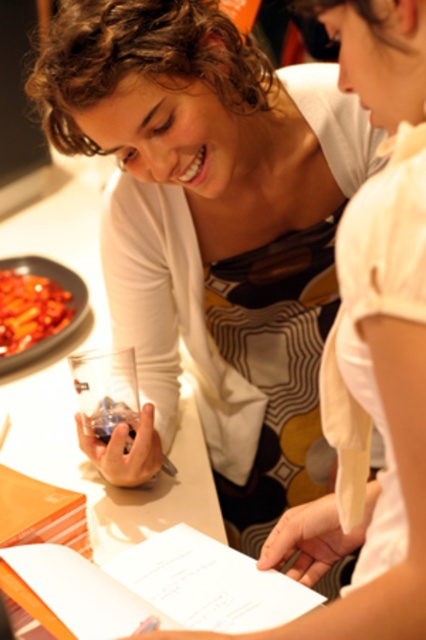
You are a bartender preparing a drink. You have a clear glass at center and a smooth glossy red sauce at left. Which item should you use to pour a liquid into the glass?

The clear glass at center is the appropriate item to pour the liquid into, as it is designed for holding beverages, while the smooth glossy red sauce at left is likely a sauce container and not meant for drinking.

You are a chef preparing a dish and need to check the thickness of the patterned fabric apron at center and the smooth glossy red sauce at left. Which object is thinner?

The patterned fabric apron at center is thinner than the smooth glossy red sauce at left.